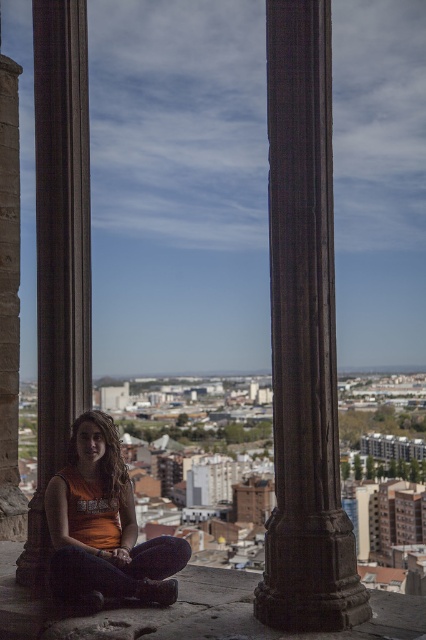
Which of these two, dark stone column at center or orange fabric at center, stands taller?

dark stone column at center is taller.

Measure the distance between point (316, 227) and camera.

Point (316, 227) and camera are 49.16 meters apart from each other.

Locate an element on the screen. Image resolution: width=426 pixels, height=640 pixels. dark stone column at center is located at coordinates (304, 337).

From the picture: Measure the distance between dark stone column at center and brown stone pillar at left.

dark stone column at center and brown stone pillar at left are 18.60 meters apart.

Who is more distant from viewer, (316,308) or (14,500)?

The point (14,500) is behind.

Locate an element on the screen. Image resolution: width=426 pixels, height=640 pixels. dark stone column at center is located at coordinates pyautogui.click(x=304, y=337).

What do you see at coordinates (103, 525) in the screenshot?
I see `orange fabric at center` at bounding box center [103, 525].

Can you confirm if orange fabric at center is positioned to the right of brown stone pillar at left?

Yes, orange fabric at center is to the right of brown stone pillar at left.

In the scene shown: Who is more forward, (63,492) or (3,72)?

Positioned in front is point (63,492).

Image resolution: width=426 pixels, height=640 pixels. Identify the location of orange fabric at center. (103, 525).